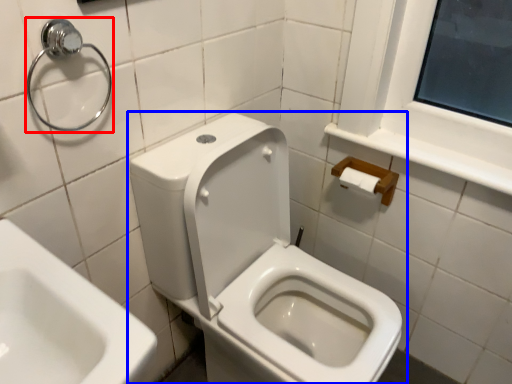
Question: Among these objects, which one is nearest to the camera, shower (highlighted by a red box) or toilet (highlighted by a blue box)?

Choices:
 (A) shower
 (B) toilet

Answer: (B)